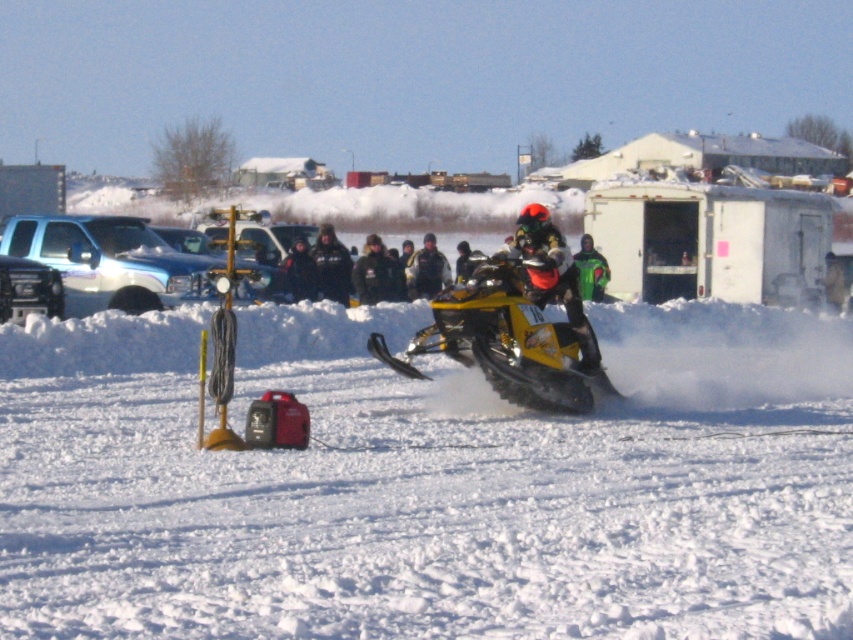
Question: Is black leather jacket at center closer to camera compared to dark green jacket at center?

Choices:
 (A) yes
 (B) no

Answer: (A)

Question: Which point appears closest to the camera in this image?

Choices:
 (A) (433, 291)
 (B) (581, 252)
 (C) (328, 244)
 (D) (572, 362)

Answer: (D)

Question: Is yellow matte snowmobile at center to the left of black leather jacket at center from the viewer's perspective?

Choices:
 (A) yes
 (B) no

Answer: (B)

Question: Which point appears farthest from the camera in this image?

Choices:
 (A) (410, 355)
 (B) (587, 282)
 (C) (436, 289)

Answer: (C)

Question: Which point is farther to the camera?

Choices:
 (A) (318, 241)
 (B) (599, 294)

Answer: (B)

Question: Does yellow matte snowmobile at center appear on the left side of green matte jacket at center?

Choices:
 (A) no
 (B) yes

Answer: (B)